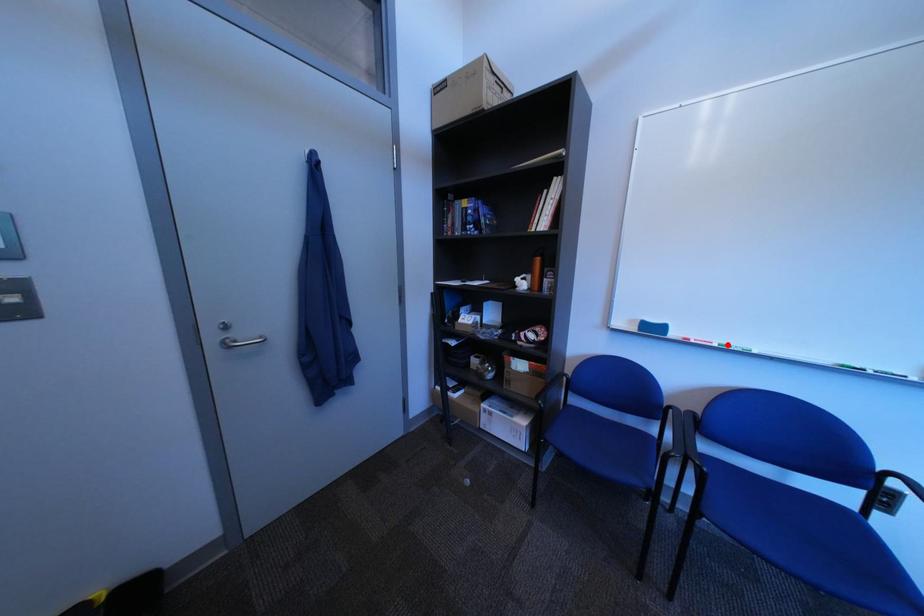
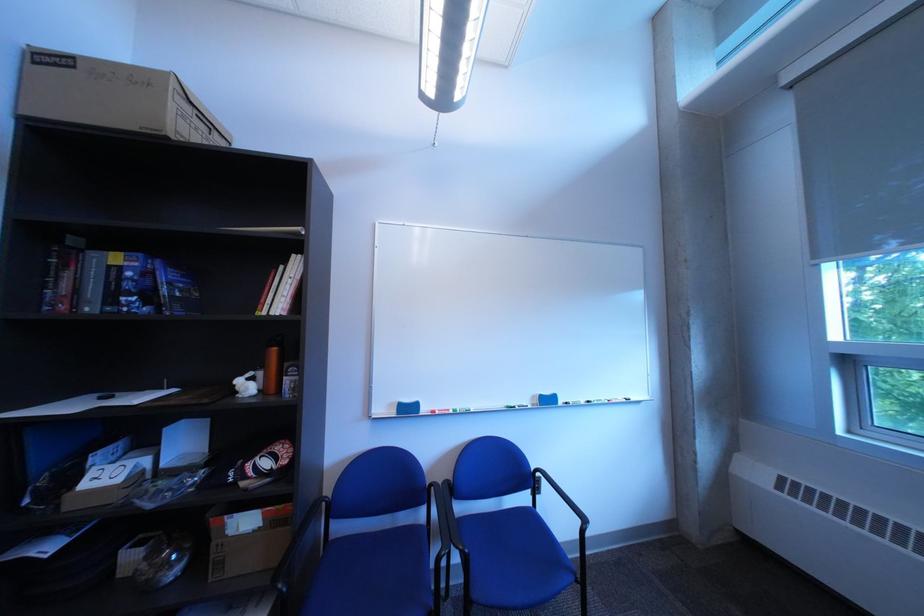
The point at the highlighted location is marked in the first image. Where is the corresponding point in the second image?

(465, 411)